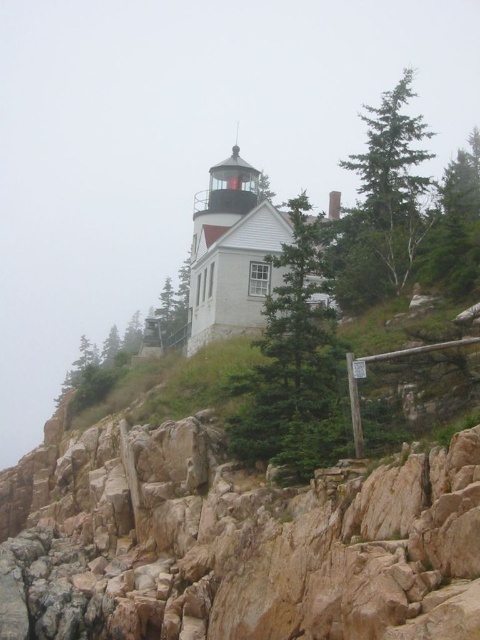
Question: Is green textured tree at upper right bigger than green matte tree at upper right?

Choices:
 (A) no
 (B) yes

Answer: (A)

Question: Which point appears closest to the camera in this image?

Choices:
 (A) (404, 230)
 (B) (334, 321)
 (C) (451, 282)

Answer: (B)

Question: Does green textured tree at center come in front of green textured tree at upper right?

Choices:
 (A) no
 (B) yes

Answer: (B)

Question: Does green textured tree at center appear on the left side of green textured tree at upper right?

Choices:
 (A) yes
 (B) no

Answer: (A)

Question: Which of the following is the closest to the observer?

Choices:
 (A) green matte tree at upper right
 (B) green textured tree at center

Answer: (B)

Question: Estimate the real-world distances between objects in this image. Which object is farther from the green textured tree at upper right?

Choices:
 (A) green matte tree at upper right
 (B) green textured tree at center

Answer: (A)